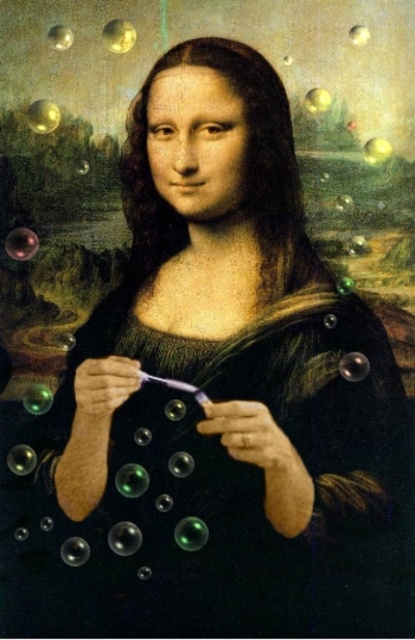
Based on the scene described, which bubble is more likely to be wider, the glossy black bubble at lower center or the transparent glass bubble at upper left?

The glossy black bubble at lower center might be wider than transparent glass bubble at upper left according to the description.

You are an art conservator examining the digitally altered Mona Lisa. You notice two bubbles in the scene. Which bubble, the metallic gold bubble at upper left or the glossy black bubble at lower center, is shorter in height?

The metallic gold bubble at upper left has a lesser height compared to the glossy black bubble at lower center, so the metallic gold bubble at upper left is shorter in height.